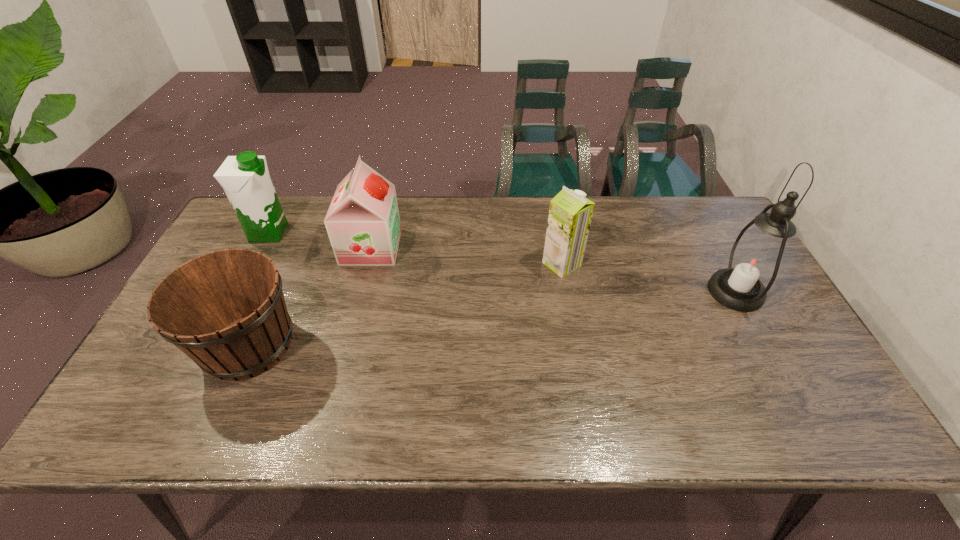
Where is `free spot that satisfies the following two spatial constraints: 1. on the front-facing side of the leftmost soya milk; 2. on the left side of the tallest object`? free spot that satisfies the following two spatial constraints: 1. on the front-facing side of the leftmost soya milk; 2. on the left side of the tallest object is located at coordinates (238, 292).

Where is `vacant space that satisfies the following two spatial constraints: 1. on the back side of the shortest object; 2. on the front-facing side of the leftmost soya milk`? The height and width of the screenshot is (540, 960). vacant space that satisfies the following two spatial constraints: 1. on the back side of the shortest object; 2. on the front-facing side of the leftmost soya milk is located at coordinates tap(298, 233).